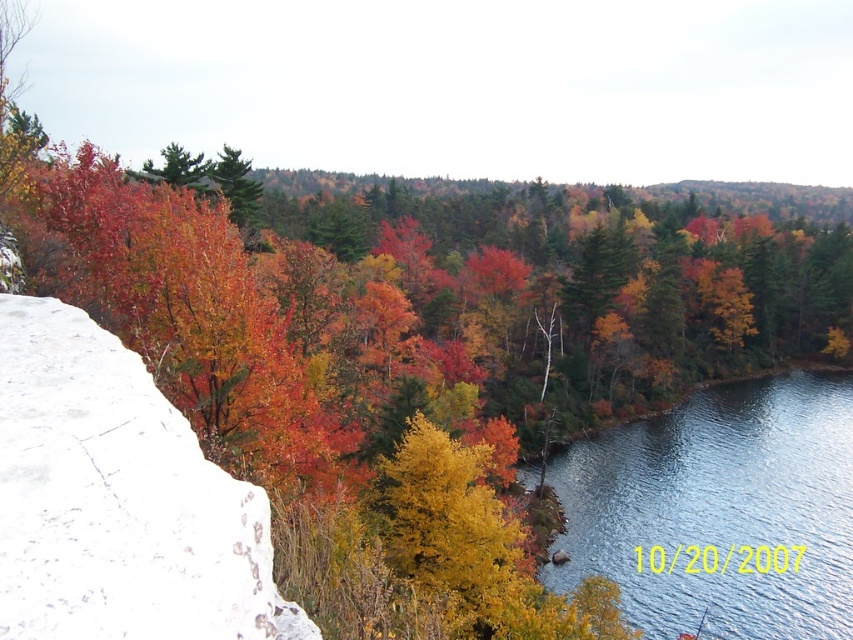
Is white rough stone at left taller than blue smooth water at lower right?

No, white rough stone at left is not taller than blue smooth water at lower right.

What do you see at coordinates (119, 499) in the screenshot? I see `white rough stone at left` at bounding box center [119, 499].

Is point (64, 520) farther from viewer compared to point (744, 480)?

No, it is in front of (744, 480).

Identify the location of white rough stone at left. This screenshot has height=640, width=853. click(119, 499).